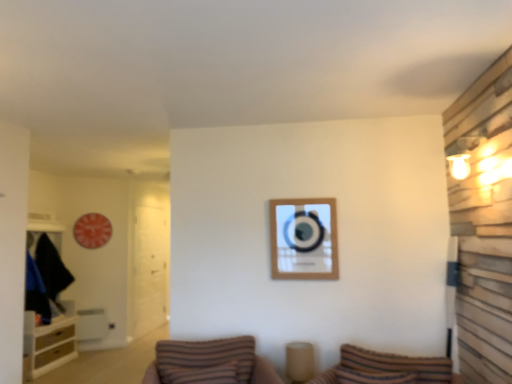
Question: Does brown striped pillow at center have a smaller size compared to transparent glass door at left?

Choices:
 (A) no
 (B) yes

Answer: (B)

Question: Can you confirm if brown striped pillow at center is positioned to the left of transparent glass door at left?

Choices:
 (A) no
 (B) yes

Answer: (A)

Question: Is brown striped pillow at center further to the viewer compared to transparent glass door at left?

Choices:
 (A) no
 (B) yes

Answer: (A)

Question: Could you tell me if brown striped pillow at center is facing transparent glass door at left?

Choices:
 (A) yes
 (B) no

Answer: (B)

Question: Is transparent glass door at left surrounded by brown striped pillow at center?

Choices:
 (A) no
 (B) yes

Answer: (A)

Question: Is brown striped pillow at center positioned beyond the bounds of transparent glass door at left?

Choices:
 (A) yes
 (B) no

Answer: (A)

Question: Is wooden cabinet at left outside of striped fabric pillow at lower center?

Choices:
 (A) no
 (B) yes

Answer: (B)

Question: Considering the relative sizes of wooden cabinet at left and striped fabric pillow at lower center in the image provided, is wooden cabinet at left wider than striped fabric pillow at lower center?

Choices:
 (A) yes
 (B) no

Answer: (A)

Question: Considering the relative sizes of wooden cabinet at left and striped fabric pillow at lower center in the image provided, is wooden cabinet at left taller than striped fabric pillow at lower center?

Choices:
 (A) yes
 (B) no

Answer: (A)

Question: From a real-world perspective, is wooden cabinet at left over striped fabric pillow at lower center?

Choices:
 (A) no
 (B) yes

Answer: (B)

Question: Considering the relative sizes of wooden cabinet at left and striped fabric pillow at lower center in the image provided, is wooden cabinet at left thinner than striped fabric pillow at lower center?

Choices:
 (A) no
 (B) yes

Answer: (A)

Question: Is striped fabric pillow at lower center inside wooden cabinet at left?

Choices:
 (A) yes
 (B) no

Answer: (B)

Question: Is brown striped pillow at center outside striped fabric pillow at lower center?

Choices:
 (A) no
 (B) yes

Answer: (B)